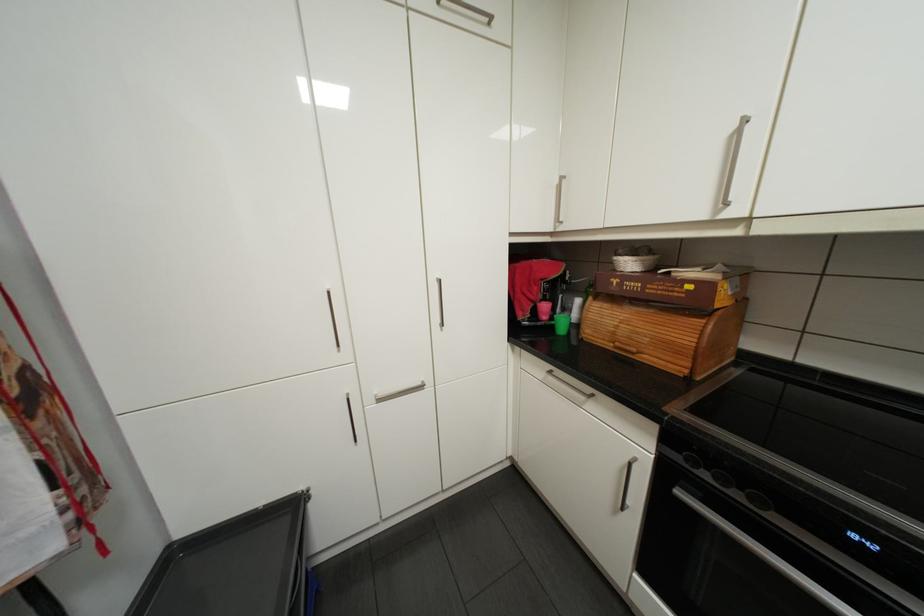
Where would you slid the bread box lid? Please return your answer as a coordinate pair (x, y).

(638, 323)